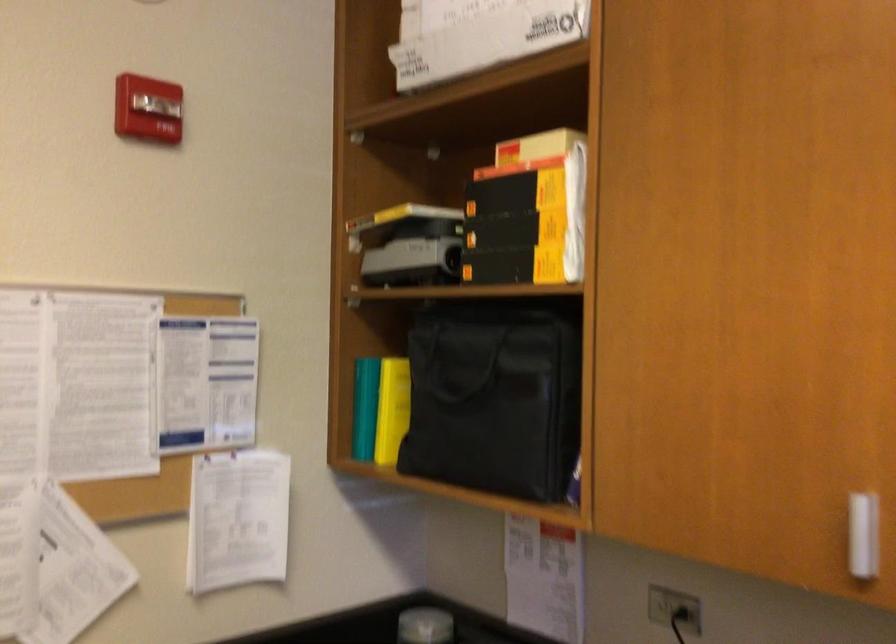
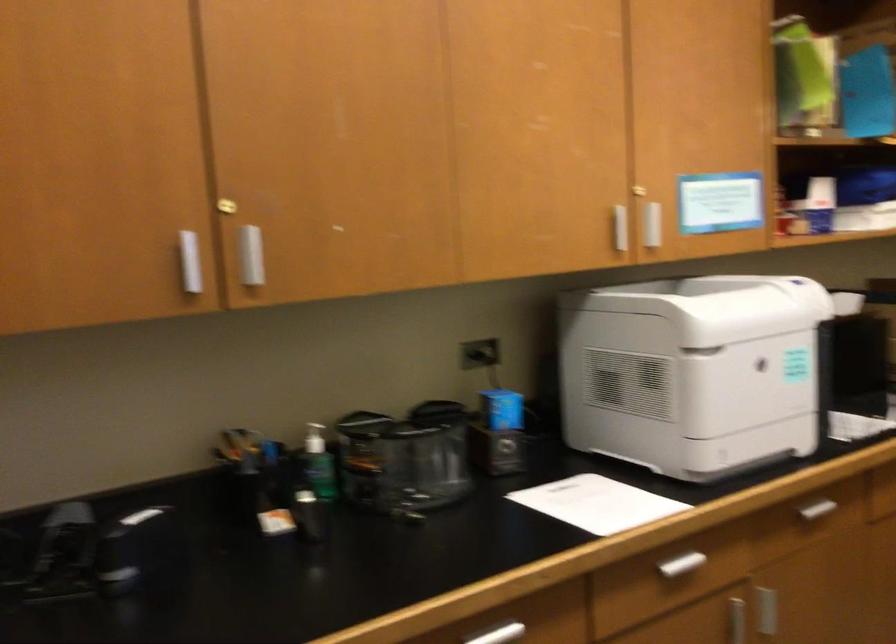
Question: The images are taken continuously from a first-person perspective. In which direction is your viewpoint rotating?

Choices:
 (A) Left
 (B) Right
 (C) Up
 (D) Down

Answer: (B)